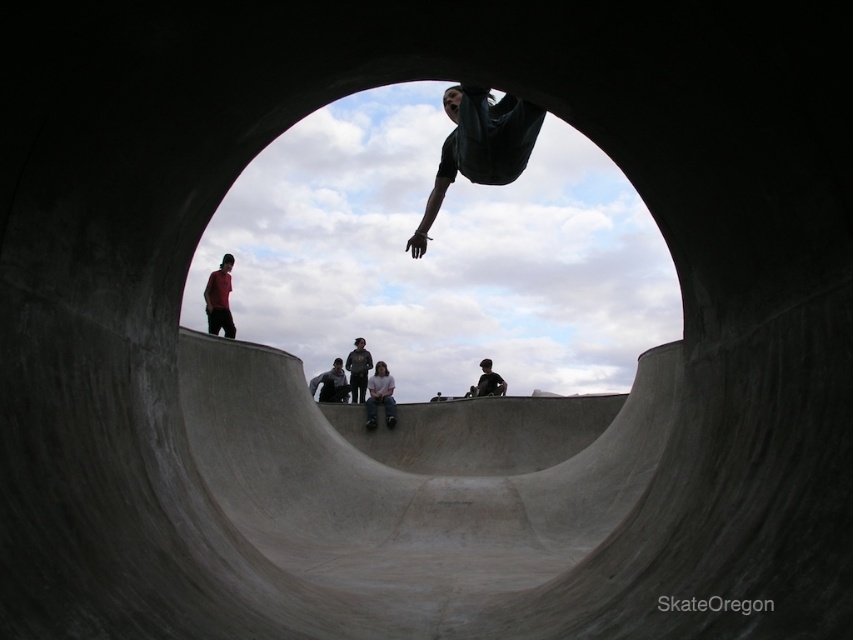
You are standing at the bottom of the skatepark bowl and want to place a small sticker exactly where the dark green fabric at center is located. What coordinates should you aim for?

The dark green fabric at center is located at coordinates point (x=479, y=147), so you should aim for those coordinates to place the sticker.

You are a photographer standing at the bottom of the skatepark bowl. You want to take a photo of both the dark green fabric at center and the light gray jeans at center. The minimum distance your camera can focus on two objects is 30 meters. Can you capture both in one shot?

The dark green fabric at center is 33.53 meters from the light gray jeans at center. Since the distance between them is greater than 30 meters, your camera cannot focus on both objects in one shot.